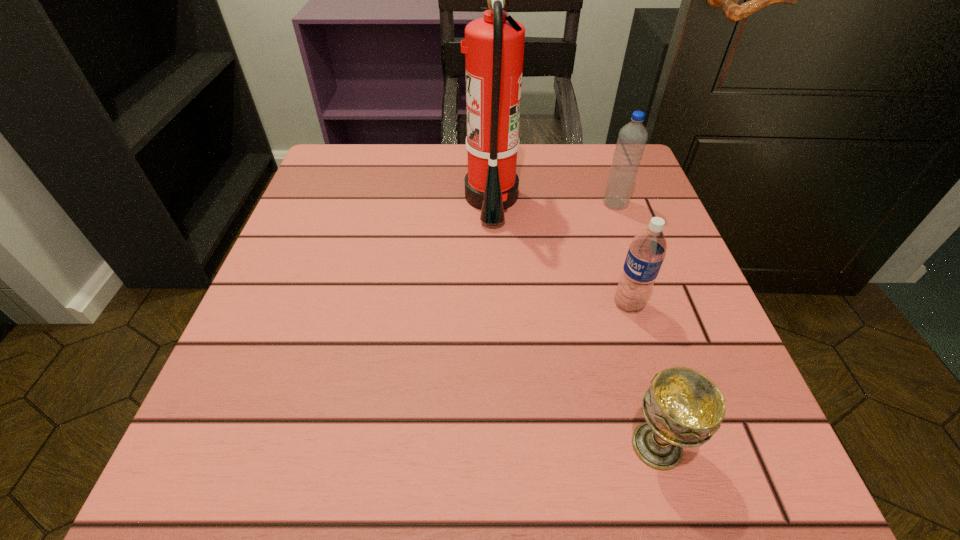
Find the location of a particular element. Image resolution: width=960 pixels, height=540 pixels. vacant space at the right edge of the desktop is located at coordinates (629, 227).

You are a GUI agent. You are given a task and a screenshot of the screen. Output one action in this format:
    pyautogui.click(x=<x>, y=<y>)
    Task: Click on the free space at the far left corner of the desktop
    Image resolution: width=960 pixels, height=540 pixels.
    Given the screenshot: What is the action you would take?
    pyautogui.click(x=364, y=199)

Locate an element on the screen. The image size is (960, 540). free region at the near left corner of the desktop is located at coordinates (316, 448).

Find the location of `free spot at the far right corner of the desktop`. free spot at the far right corner of the desktop is located at coordinates (582, 162).

Identify the location of vacant space at the near right corner of the desktop. The height and width of the screenshot is (540, 960). (771, 464).

I want to click on free space between the chalice and the tallest object, so click(x=574, y=322).

At what (x,y) coordinates should I click in order to perform the action: click on vacant space that's between the nearer water bottle and the farther water bottle. Please return your answer as a coordinate pair (x, y). Looking at the image, I should click on (622, 254).

Find the location of a particular element. The width and height of the screenshot is (960, 540). free spot between the fire extinguisher and the nearest object is located at coordinates (574, 322).

I want to click on vacant space in between the nearest object and the tallest object, so 574,322.

At what (x,y) coordinates should I click in order to perform the action: click on empty space between the shortest object and the fire extinguisher. Please return your answer as a coordinate pair (x, y). This screenshot has width=960, height=540. Looking at the image, I should click on (574, 322).